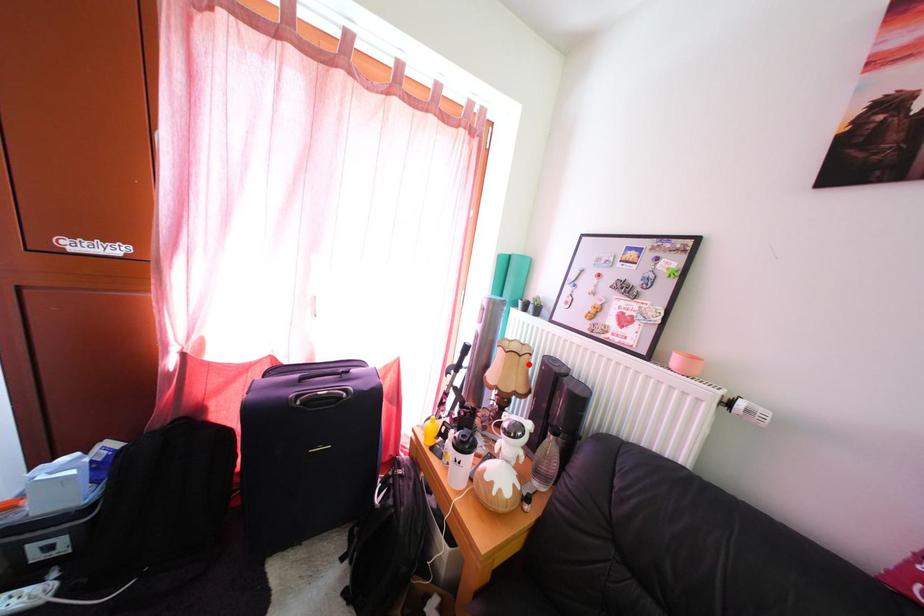
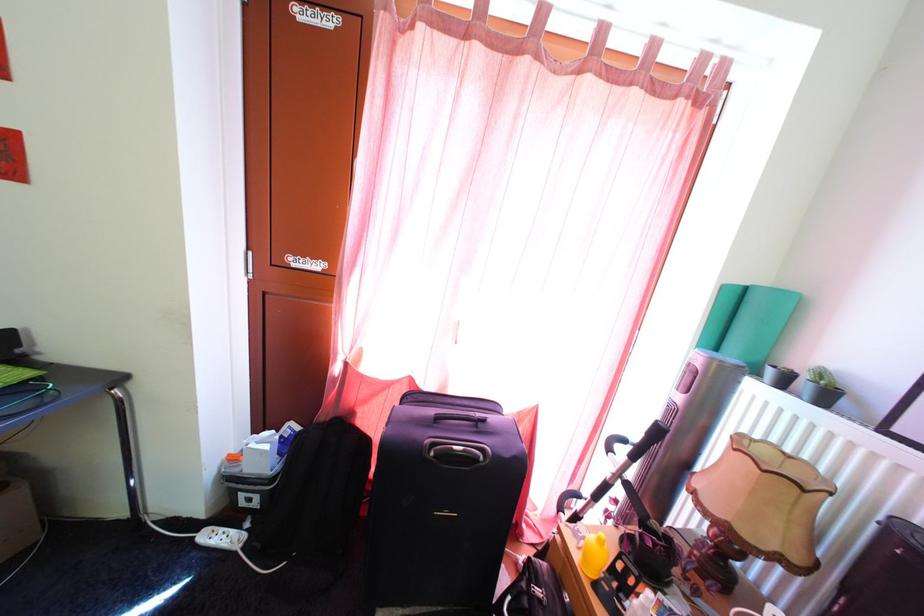
Locate, in the second image, the point that corresponds to the highlighted location in the first image.

(812, 499)